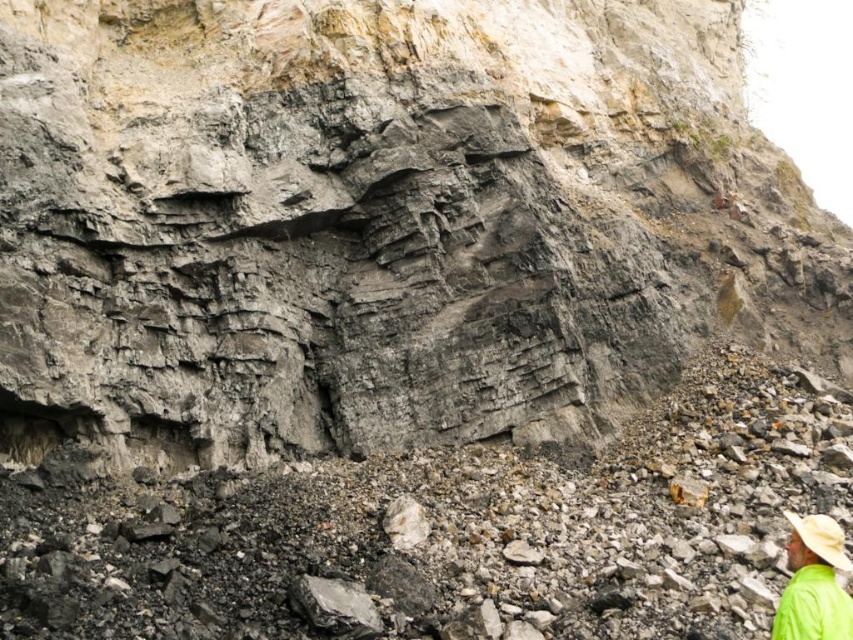
Does point (839, 540) lie in front of point (787, 509)?

Yes.

Who is shorter, green fabric hat at lower right or beige straw hat at lower right?

Standing shorter between the two is beige straw hat at lower right.

I want to click on green fabric hat at lower right, so click(814, 582).